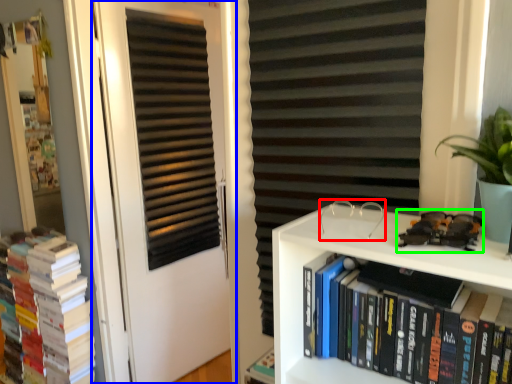
Question: Considering the real-world distances, which object is farthest from glasses (highlighted by a red box)? door (highlighted by a blue box) or toy car (highlighted by a green box)?

Choices:
 (A) door
 (B) toy car

Answer: (A)